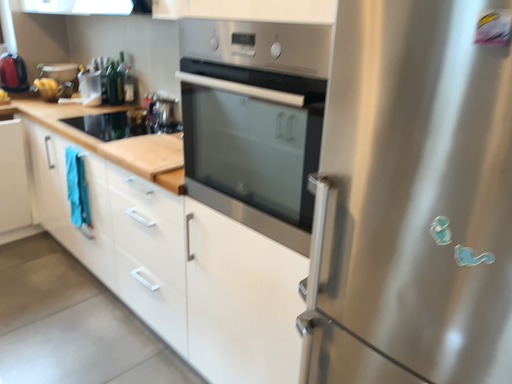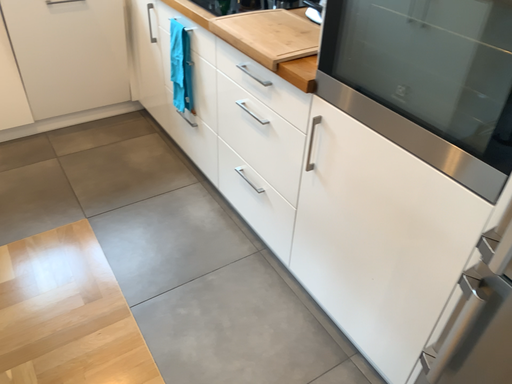
Question: Which way did the camera rotate in the video?

Choices:
 (A) rotated downward
 (B) rotated upward

Answer: (A)